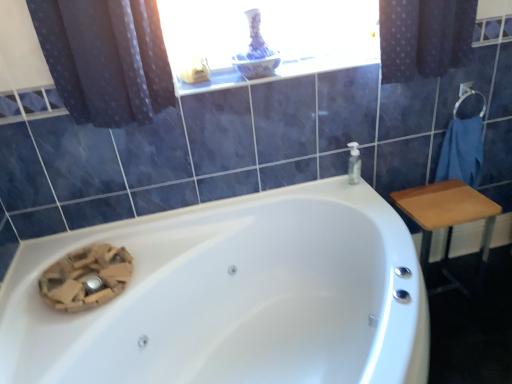
At what (x,y) coordinates should I click in order to perform the action: click on free space in front of transparent plastic soap dispenser at upper right. Please return your answer as a coordinate pair (x, y). Looking at the image, I should click on (365, 198).